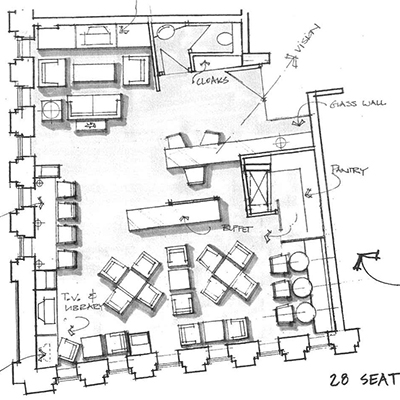
Point to all occurrences of t.v. icon in the image. Your answer should be formatted as a list of tuples, i.e. [(x1, y1), (x2, y2), ...], where each tuple contains the x and y coordinates of a point satisfying the conditions above.

[(46, 317), (92, 35)]